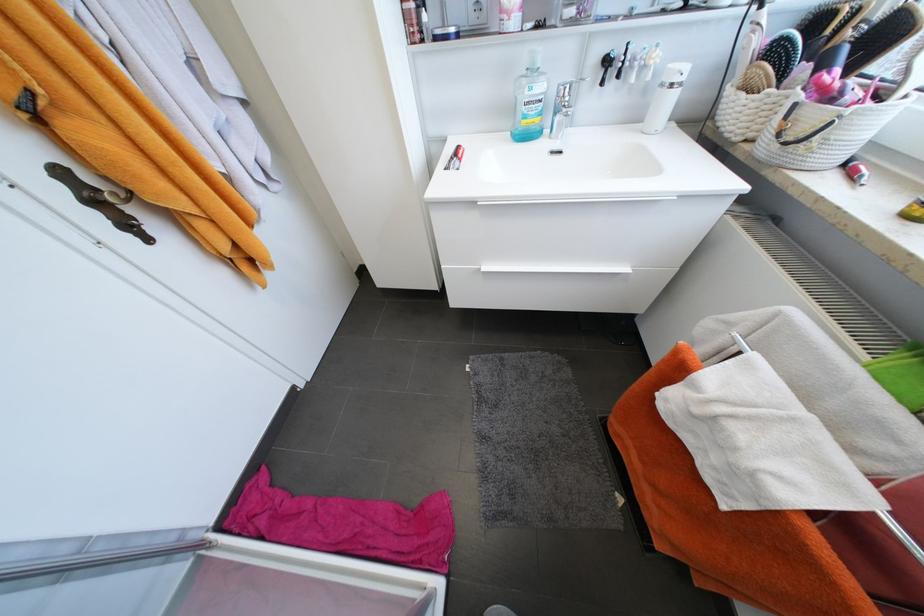
This screenshot has width=924, height=616. What do you see at coordinates (87, 556) in the screenshot?
I see `the shower door handle` at bounding box center [87, 556].